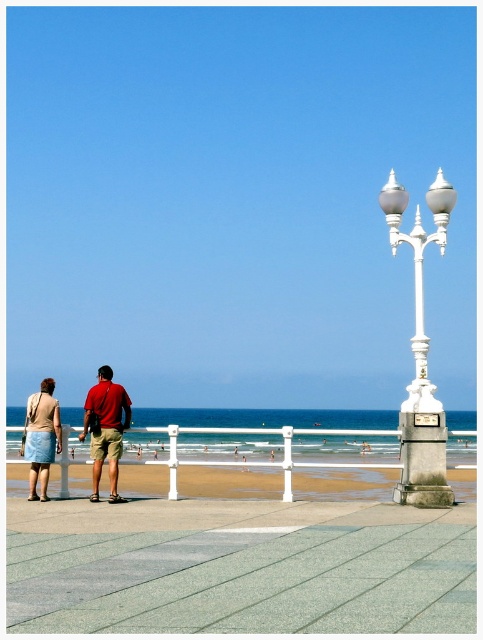
You are a photographer trying to capture the smooth sand beach at center and the matte red shirt at center in the same frame. Based on their positions, which object would appear closer to the camera in the photo?

The smooth sand beach at center appears closer to the camera because it is much taller than the matte red shirt at center, indicating it occupies a more prominent position in the foreground.

You are standing on the paved walkway and want to walk directly towards the smooth sand beach at center. Which direction should you move relative to the matte red shirt at center?

You should move to the right of the matte red shirt at center because the smooth sand beach at center is located to the right of it.